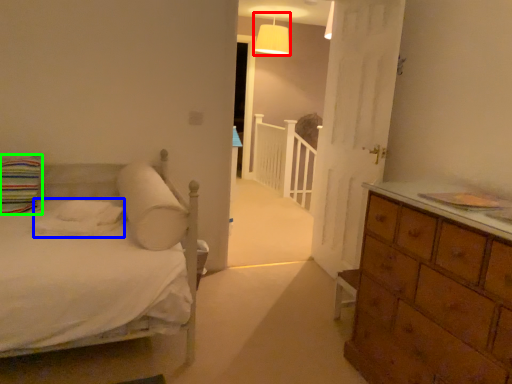
Question: Estimate the real-world distances between objects in this image. Which object is farther from lamp (highlighted by a red box), sheet (highlighted by a blue box) or pillow (highlighted by a green box)?

Choices:
 (A) sheet
 (B) pillow

Answer: (A)